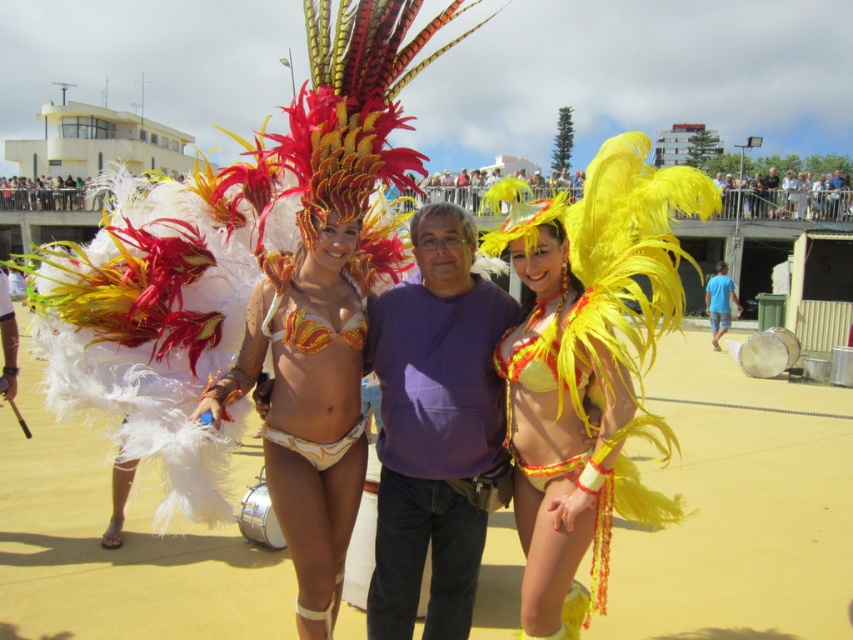
Looking at this image, you are standing in the crowd watching the parade and want to take a photo of the shiny sequined bikini top at center. If your camera has a maximum focus range of 3 meters, will you be able to capture it clearly?

The shiny sequined bikini top at center is 3.21 meters away from the viewer. Since the camera can only focus up to 3 meters, it won

You are a photographer trying to capture a closeup shot of both the shiny sequined bikini top at center and the yellow feathered bikini at center. Since your camera can only focus on one object at a time, which one should you adjust the focus for first if you want to ensure the wider object is in sharp detail?

The shiny sequined bikini top at center is wider than the yellow feathered bikini at center. Therefore, you should adjust the focus for the shiny sequined bikini top at center first to ensure its wider area is captured sharply.

You are a photographer trying to capture the two women in the center of the image. The shiny sequined bikini top at center and the yellow feathered bikini at center are both important to include in your shot. However, you notice that one of them is partially blocking the other. Which one is more visible in the current arrangement?

The shiny sequined bikini top at center is more visible because the yellow feathered bikini at center is positioned behind it.